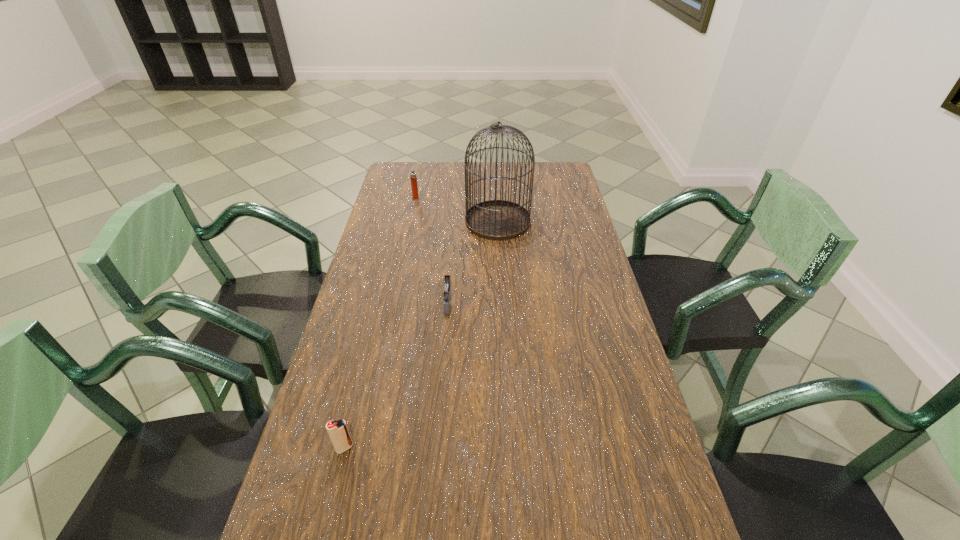
In order to click on free space between the second nearest igniter and the rightmost object in this screenshot , I will do `click(473, 262)`.

Locate an element on the screen. free space between the nearest igniter and the rightmost igniter is located at coordinates (396, 375).

The height and width of the screenshot is (540, 960). I want to click on unoccupied area between the rightmost igniter and the farthest object, so click(x=432, y=250).

At what (x,y) coordinates should I click in order to perform the action: click on free space that is in between the leftmost igniter and the second object from right to left. Please return your answer as a coordinate pair (x, y). Image resolution: width=960 pixels, height=540 pixels. Looking at the image, I should click on (396, 375).

The image size is (960, 540). Find the location of `vacant space that's between the second farthest igniter and the birdcage`. vacant space that's between the second farthest igniter and the birdcage is located at coordinates (473, 262).

Find the location of a particular element. The width and height of the screenshot is (960, 540). empty space that is in between the third farthest object and the leftmost igniter is located at coordinates (396, 375).

Locate an element on the screen. The image size is (960, 540). the third closest object to the leftmost igniter is located at coordinates (413, 177).

Locate an element on the screen. object that is the second nearest to the second nearest object is located at coordinates (338, 432).

The height and width of the screenshot is (540, 960). Find the location of `igniter that is the closest to the nearest igniter`. igniter that is the closest to the nearest igniter is located at coordinates (446, 288).

You are a GUI agent. You are given a task and a screenshot of the screen. Output one action in this format:
    pyautogui.click(x=<x>, y=<y>)
    Task: Click on the igniter that is the closest one to the tallest object
    
    Given the screenshot: What is the action you would take?
    pyautogui.click(x=413, y=177)